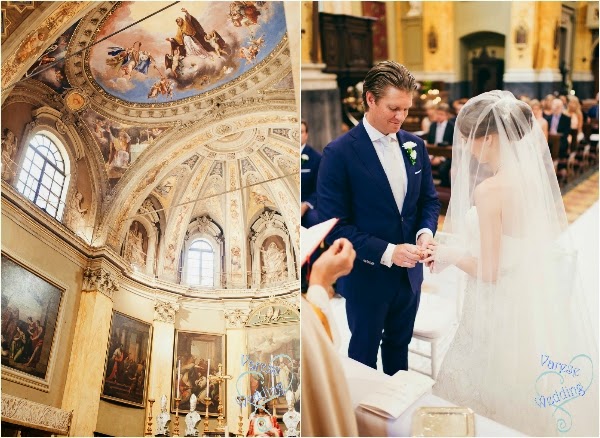
At what (x,y) coordinates should I click in order to perform the action: click on tall candles. Please return your answer as a coordinate pair (x, y). Looking at the image, I should click on (178, 390), (208, 392).